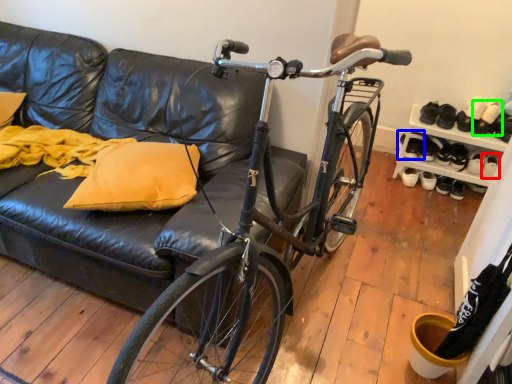
Question: Which is nearer to the footwear (highlighted by a red box)? footwear (highlighted by a blue box) or footwear (highlighted by a green box).

Choices:
 (A) footwear
 (B) footwear

Answer: (B)